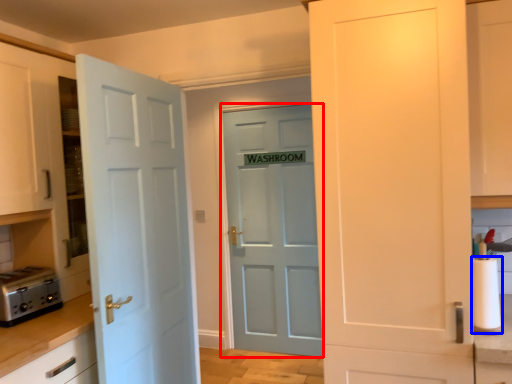
Question: Which object appears closest to the camera in this image, door (highlighted by a red box) or paper towel (highlighted by a blue box)?

Choices:
 (A) door
 (B) paper towel

Answer: (B)